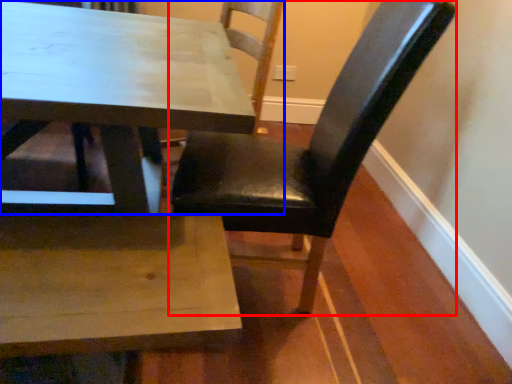
Question: Which point is closer to the camera, chair (highlighted by a red box) or chair (highlighted by a blue box)?

Choices:
 (A) chair
 (B) chair

Answer: (A)